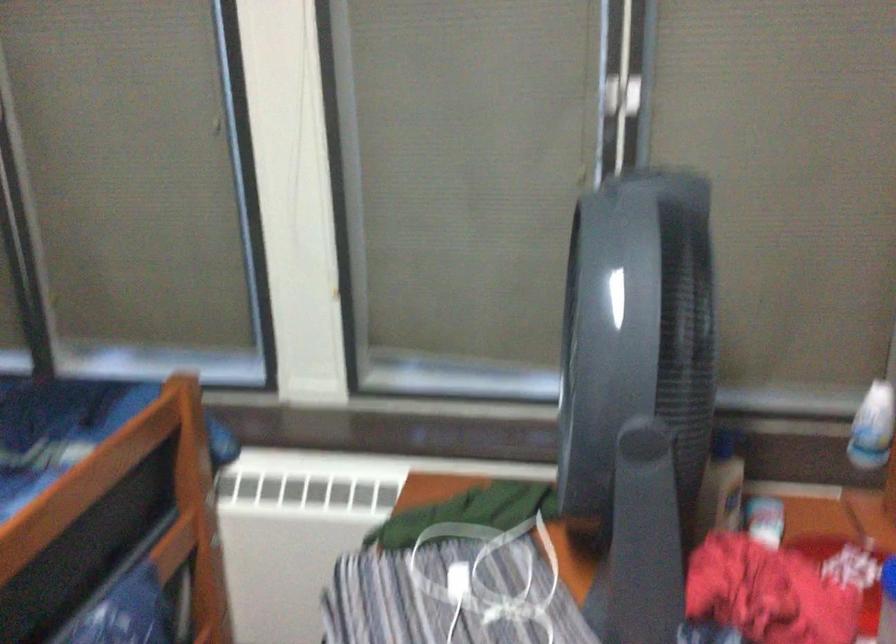
Locate an element on the screen. This screenshot has width=896, height=644. window crank handle is located at coordinates (645, 521).